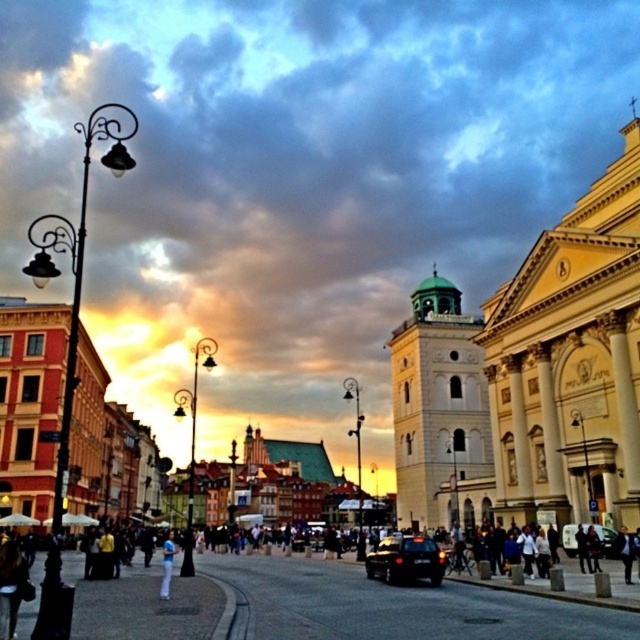
You are a pedestrian standing at the edge of the street. You see a black matte car at lower center and a shiny black car at center. Which car is closer to you?

The black matte car at lower center is closer to you because it is in front of the shiny black car at center.

You are a pedestrian standing at the edge of the street. You see a shiny black car at center and white cotton pants at lower center. Which object is located to the right of the other?

The shiny black car at center is positioned on the right side of white cotton pants at lower center.